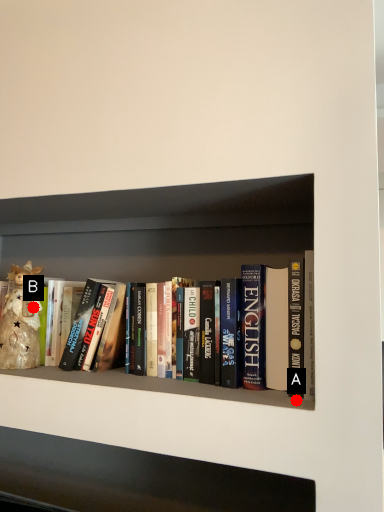
Question: Two points are circled on the image, labeled by A and B beside each circle. Which point is farther from the camera taking this photo?

Choices:
 (A) A is further
 (B) B is further

Answer: (B)